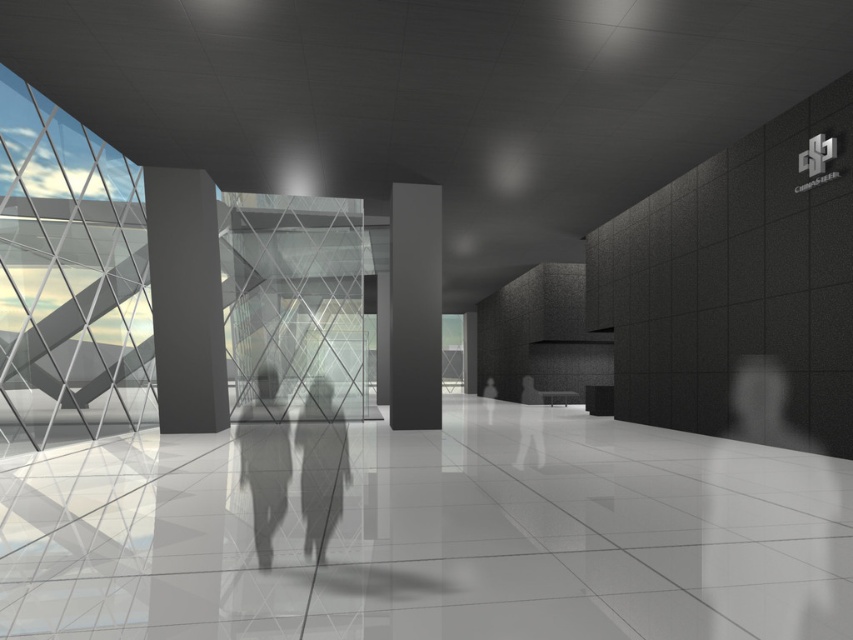
Which is below, matte gray column at center or smooth gray figure at center?

smooth gray figure at center is below.

Which is more to the right, matte gray column at center or smooth gray figure at center?

smooth gray figure at center is more to the right.

Who is more distant from viewer, [184,324] or [303,452]?

Positioned behind is point [184,324].

Locate an element on the screen. Image resolution: width=853 pixels, height=640 pixels. matte gray column at center is located at coordinates (184, 300).

Between point (184, 180) and point (264, 552), which one is positioned behind?

The point (184, 180) is more distant.

Where is `matte gray column at center`? The width and height of the screenshot is (853, 640). matte gray column at center is located at coordinates (184, 300).

Between point (207, 218) and point (424, 400), which one is positioned behind?

The point (424, 400) is more distant.

Between matte gray column at center and matte black pillar at center, which one has less height?

matte black pillar at center

Which is behind, point (190, 380) or point (415, 371)?

The point (415, 371) is behind.

Image resolution: width=853 pixels, height=640 pixels. I want to click on matte gray column at center, so click(x=184, y=300).